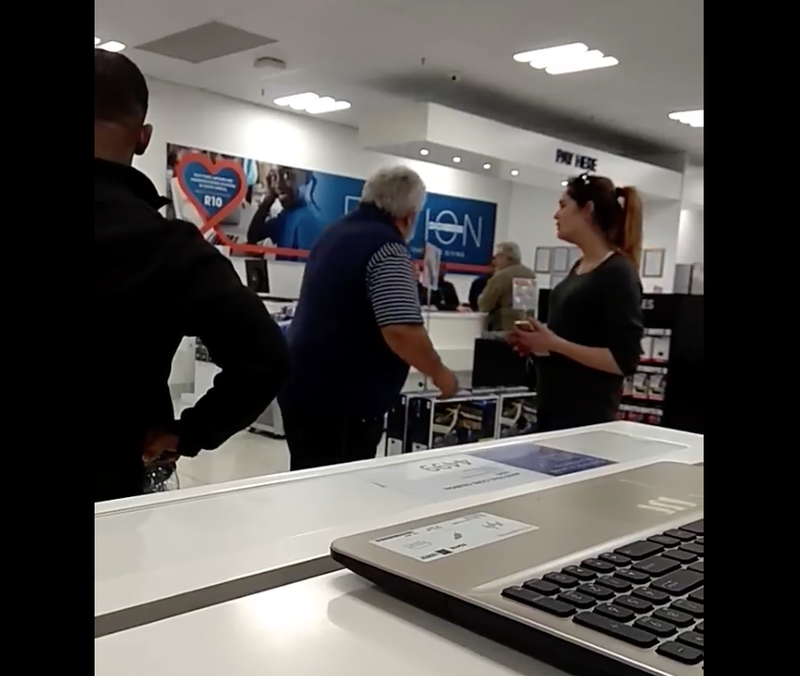
In order to click on chair in this screenshot , I will do `click(597, 203)`.